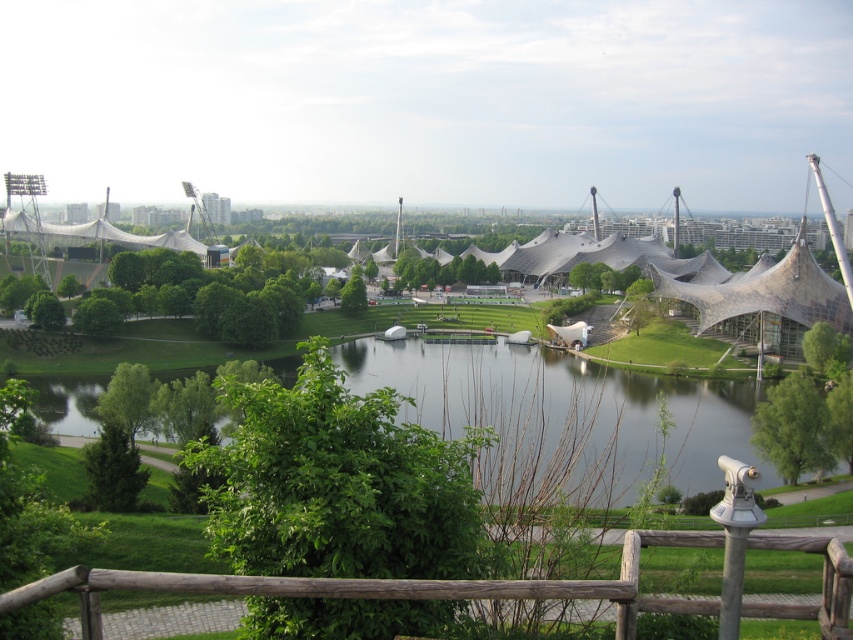
Question: Which object appears closest to the camera in this image?

Choices:
 (A) green grassy river at center
 (B) brown wooden rail at lower center
 (C) textured fabric dome at center

Answer: (B)

Question: Considering the relative positions of textured fabric dome at center and brown wooden rail at lower center in the image provided, where is textured fabric dome at center located with respect to brown wooden rail at lower center?

Choices:
 (A) right
 (B) left

Answer: (B)

Question: Considering the relative positions of green grassy river at center and textured fabric dome at center in the image provided, where is green grassy river at center located with respect to textured fabric dome at center?

Choices:
 (A) below
 (B) above

Answer: (B)

Question: Among these objects, which one is farthest from the camera?

Choices:
 (A) brown wooden rail at lower center
 (B) green grassy river at center

Answer: (B)

Question: Which point appears farthest from the camera in this image?

Choices:
 (A) (445, 593)
 (B) (312, 589)

Answer: (B)

Question: Is green grassy river at center further to the viewer compared to brown wooden rail at lower center?

Choices:
 (A) yes
 (B) no

Answer: (A)